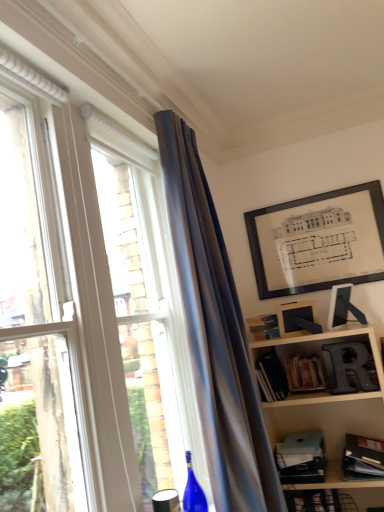
Question: Is blue glass wine bottle at lower center facing towards matte glass window at left?

Choices:
 (A) no
 (B) yes

Answer: (B)

Question: Does blue glass wine bottle at lower center come behind matte glass window at left?

Choices:
 (A) no
 (B) yes

Answer: (B)

Question: Can you confirm if blue glass wine bottle at lower center is smaller than matte glass window at left?

Choices:
 (A) yes
 (B) no

Answer: (A)

Question: Is blue glass wine bottle at lower center facing away from matte glass window at left?

Choices:
 (A) no
 (B) yes

Answer: (B)

Question: Considering the relative sizes of blue glass wine bottle at lower center and matte glass window at left in the image provided, is blue glass wine bottle at lower center taller than matte glass window at left?

Choices:
 (A) no
 (B) yes

Answer: (A)

Question: In terms of width, does hardcover books at lower right, placed as the 1th book when sorted from top to bottom, look wider or thinner when compared to matte blue paperback book at lower right, which ranks as the 1th paperback book in bottom-to-top order?

Choices:
 (A) wide
 (B) thin

Answer: (B)

Question: Considering the positions of point (314, 377) and point (319, 476), is point (314, 377) closer or farther from the camera than point (319, 476)?

Choices:
 (A) closer
 (B) farther

Answer: (B)

Question: In the image, is hardcover books at lower right, the second book positioned from the right, positioned in front of or behind matte blue paperback book at lower right, which ranks as the 1th paperback book in bottom-to-top order?

Choices:
 (A) front
 (B) behind

Answer: (B)

Question: Choose the correct answer: Is hardcover books at lower right, which is counted as the 3th book, starting from the bottom, inside matte blue paperback book at lower right, which ranks as the second paperback book in top-to-bottom order, or outside it?

Choices:
 (A) outside
 (B) inside

Answer: (A)

Question: Looking at their shapes, would you say hardcover book at lower right, the 3th book positioned from the top, is wider or thinner than hardcover books at lower right, acting as the second book starting from the left?

Choices:
 (A) wide
 (B) thin

Answer: (A)

Question: Considering the relative positions of hardcover book at lower right, the first book from the right, and hardcover books at lower right, which is counted as the 3th book, starting from the bottom, in the image provided, is hardcover book at lower right, the first book from the right, to the left or to the right of hardcover books at lower right, which is counted as the 3th book, starting from the bottom,?

Choices:
 (A) left
 (B) right

Answer: (B)

Question: Does point (357, 450) appear closer or farther from the camera than point (309, 361)?

Choices:
 (A) closer
 (B) farther

Answer: (A)

Question: Is hardcover book at lower right, the first book from the right, in front of or behind hardcover books at lower right, placed as the 1th book when sorted from top to bottom, in the image?

Choices:
 (A) front
 (B) behind

Answer: (A)

Question: Considering the positions of matte glass window at left and hardcover book at center-right, which is the 3th book from right to left, in the image, is matte glass window at left wider or thinner than hardcover book at center-right, which is the 3th book from right to left,?

Choices:
 (A) wide
 (B) thin

Answer: (A)

Question: Is matte glass window at left inside or outside of hardcover book at center-right, which ranks as the 2th book in bottom-to-top order?

Choices:
 (A) outside
 (B) inside

Answer: (A)